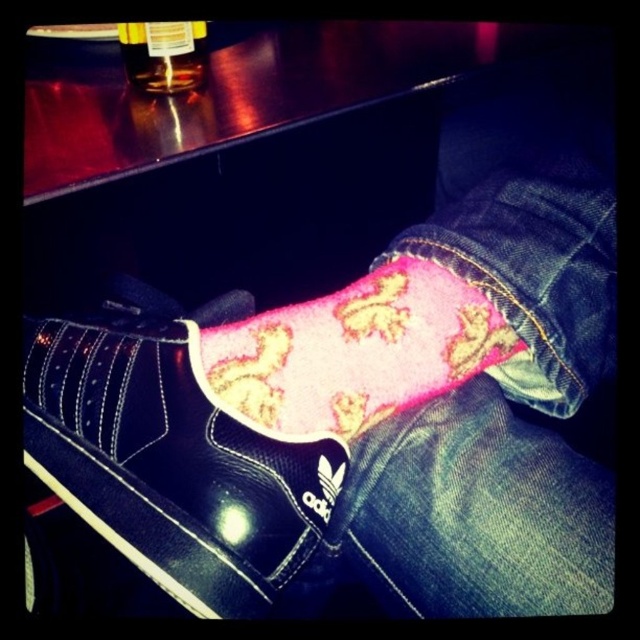
Question: Is pink fleece jeans at center thinner than black leather shoe at center?

Choices:
 (A) yes
 (B) no

Answer: (B)

Question: Can you confirm if pink fleece jeans at center is thinner than black leather shoe at center?

Choices:
 (A) no
 (B) yes

Answer: (A)

Question: Considering the real-world distances, which object is farthest from the black leather shoe at center?

Choices:
 (A) pink fleece jeans at center
 (B) pink fuzzy socks at center

Answer: (A)

Question: Among these points, which one is nearest to the camera?

Choices:
 (A) (483, 381)
 (B) (147, 65)

Answer: (A)

Question: Is pink fuzzy socks at center in front of translucent plastic bottle at upper left?

Choices:
 (A) no
 (B) yes

Answer: (B)

Question: Among these points, which one is nearest to the camera?

Choices:
 (A) (198, 352)
 (B) (156, 42)
 (C) (412, 472)
 (D) (147, 509)

Answer: (D)